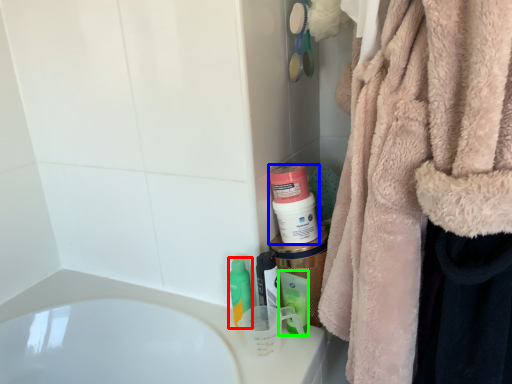
Question: Considering the real-world distances, which object is farthest from mouthwash (highlighted by a red box)? mouthwash (highlighted by a blue box) or mouthwash (highlighted by a green box)?

Choices:
 (A) mouthwash
 (B) mouthwash

Answer: (A)